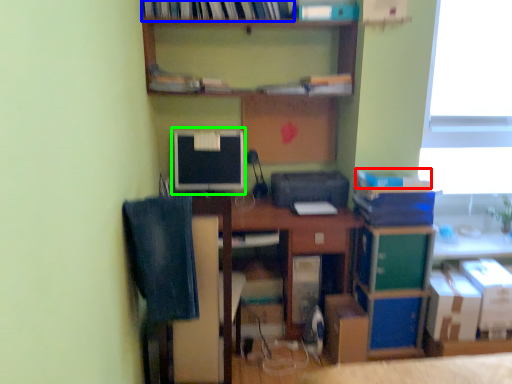
Question: Which object is the closest to the book (highlighted by a red box)? Choose among these: book (highlighted by a blue box) or computer monitor (highlighted by a green box).

Choices:
 (A) book
 (B) computer monitor

Answer: (B)